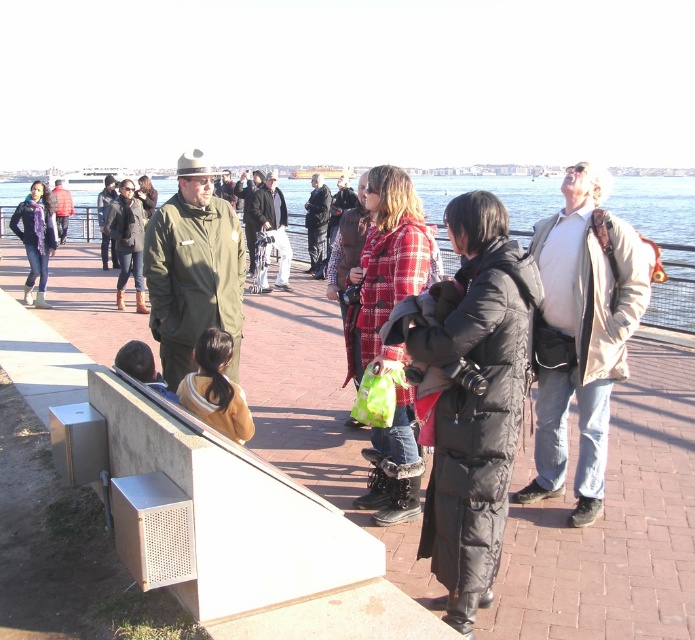
From the picture: Which of these two, khaki uniform at center or dark gray uniform at center, stands taller?

Standing taller between the two is khaki uniform at center.

What do you see at coordinates (126, 241) in the screenshot? The image size is (695, 640). I see `khaki uniform at center` at bounding box center [126, 241].

Is point (142, 304) closer to viewer compared to point (270, 205)?

Yes, point (142, 304) is closer to viewer.

I want to click on khaki uniform at center, so click(126, 241).

Is point (587, 305) behind point (31, 236)?

No, it is in front of (31, 236).

From the picture: Which of these two, light brown leather jacket at upper right or matte black jacket at left, stands shorter?

With less height is matte black jacket at left.

Is point (578, 177) closer to viewer compared to point (40, 266)?

Yes, point (578, 177) is in front of point (40, 266).

Image resolution: width=695 pixels, height=640 pixels. I want to click on light brown leather jacket at upper right, so click(582, 333).

What do you see at coordinates (386, 268) in the screenshot? I see `plaid wool coat at center` at bounding box center [386, 268].

Who is more distant from viewer, (x=400, y=392) or (x=278, y=248)?

Positioned behind is point (x=278, y=248).

Between point (386, 464) and point (275, 182), which one is positioned in front?

Point (386, 464) is in front.

This screenshot has width=695, height=640. Find the location of `plaid wool coat at center`. plaid wool coat at center is located at coordinates (386, 268).